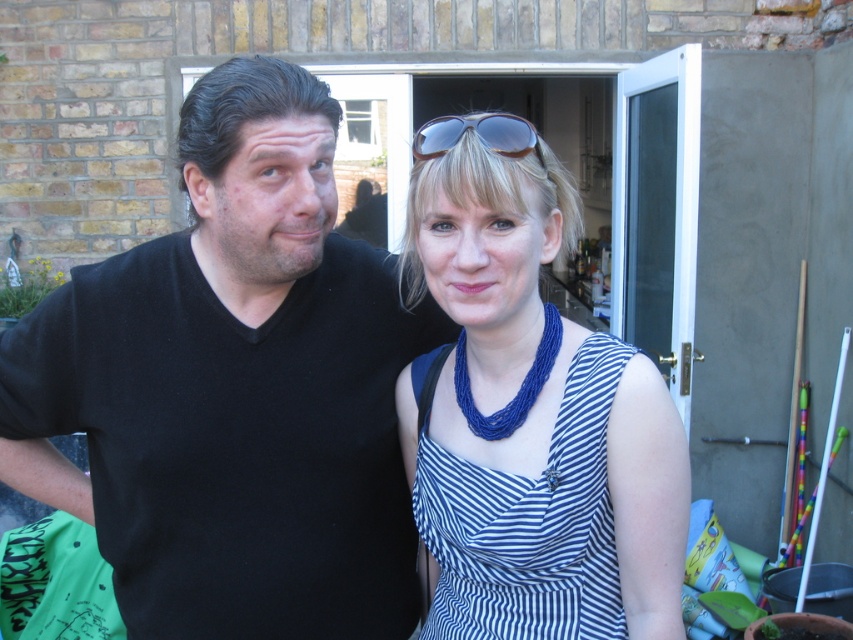
Is point (582, 326) more distant than point (498, 516)?

Yes, point (582, 326) is farther from viewer.

Can you confirm if blue woven necklace at center is smaller than blue striped dress at center?

No.

Locate an element on the screen. blue woven necklace at center is located at coordinates (531, 413).

This screenshot has width=853, height=640. Find the location of `blue woven necklace at center`. blue woven necklace at center is located at coordinates (531, 413).

Is point (444, 512) positioned behind point (538, 157)?

Yes, it is behind point (538, 157).

At what (x,y) coordinates should I click in order to perform the action: click on blue striped dress at center. Please return your answer as a coordinate pair (x, y). Looking at the image, I should click on (529, 524).

The image size is (853, 640). Identify the location of blue striped dress at center. (529, 524).

What do you see at coordinates (233, 388) in the screenshot? The image size is (853, 640). I see `black matte shirt at left` at bounding box center [233, 388].

Who is lower down, black matte shirt at left or blue woven necklace at center?

blue woven necklace at center is lower down.

Is point (268, 376) more distant than point (448, 276)?

Yes, it is behind point (448, 276).

Find the location of a particular element. The image size is (853, 640). black matte shirt at left is located at coordinates (233, 388).